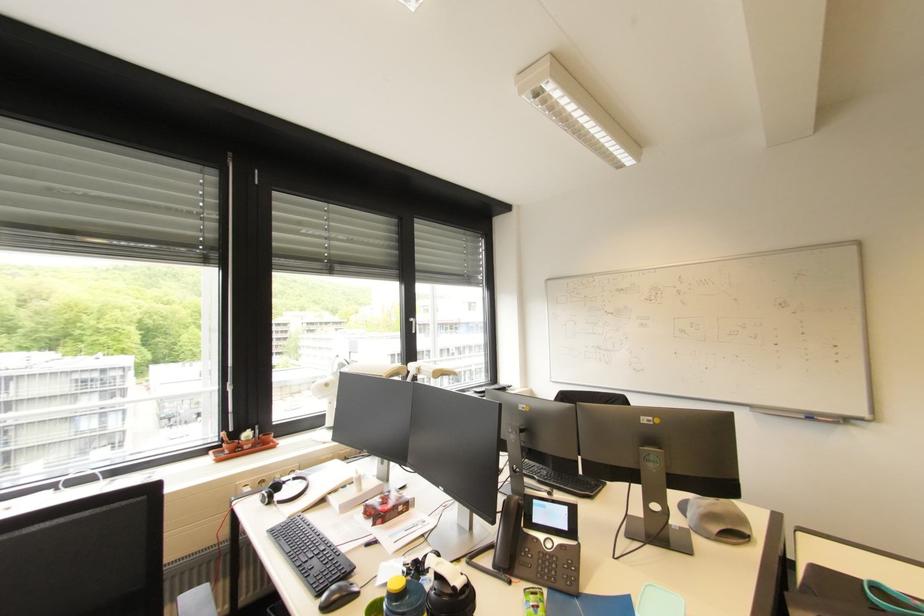
The width and height of the screenshot is (924, 616). I want to click on phone handset, so click(x=539, y=541).